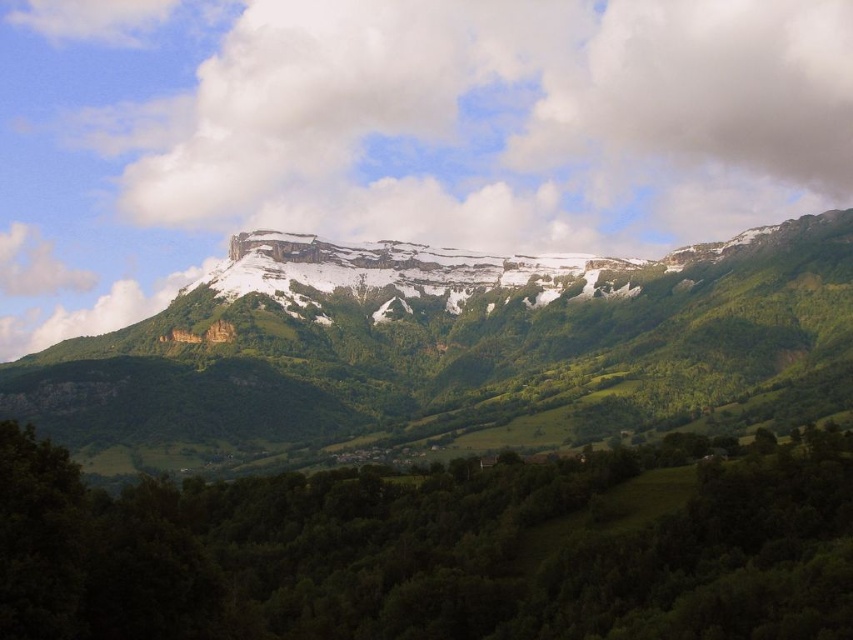
Question: Which object is positioned closest to the green leafy trees at lower center?

Choices:
 (A) white fluffy cloud at upper center
 (B) snowy rock formation at upper center

Answer: (B)

Question: Based on their relative distances, which object is farther from the white fluffy cloud at upper center?

Choices:
 (A) green leafy trees at lower center
 (B) snowy rock formation at upper center

Answer: (A)

Question: Does green leafy trees at lower center have a larger size compared to snowy rock formation at upper center?

Choices:
 (A) no
 (B) yes

Answer: (B)

Question: From the image, what is the correct spatial relationship of green leafy trees at lower center in relation to snowy rock formation at upper center?

Choices:
 (A) left
 (B) right

Answer: (B)

Question: Observing the image, what is the correct spatial positioning of white fluffy cloud at upper center in reference to snowy rock formation at upper center?

Choices:
 (A) left
 (B) right

Answer: (B)

Question: Which point appears closest to the camera in this image?

Choices:
 (A) (6, 484)
 (B) (274, 124)

Answer: (A)